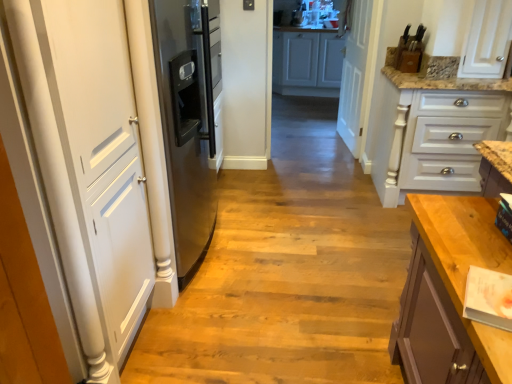
How much space does white painted wood drawers at right, the 2th cabinetry positioned from the top, occupy horizontally?

white painted wood drawers at right, the 2th cabinetry positioned from the top, is 28.20 inches in width.

What do you see at coordinates (288, 271) in the screenshot? I see `wooden floor at center` at bounding box center [288, 271].

Identify the location of white painted wood drawers at right, the 2th cabinetry viewed from the back. The height and width of the screenshot is (384, 512). (436, 133).

From the image's perspective, is white wood door at center, which is the 2th door in left-to-right order, located beneath wooden floor at center?

No, from the image's perspective, white wood door at center, which is the 2th door in left-to-right order, is not below wooden floor at center.

Could you tell me if white wood door at center, which is the 2th door in left-to-right order, is turned towards wooden floor at center?

No, white wood door at center, which is the 2th door in left-to-right order, is not oriented towards wooden floor at center.

Find the location of a particular element. the 1st door above the wooden floor at center (from a real-world perspective) is located at coordinates coord(354,74).

In terms of width, does white wood door at center, the first door viewed from the back, look wider or thinner when compared to wooden floor at center?

Considering their sizes, white wood door at center, the first door viewed from the back, looks slimmer than wooden floor at center.

Would you say white matte door at left, the 1th door viewed from the left, is to the left or to the right of white matte cabinet at center, the second cabinetry ordered from the bottom, in the picture?

white matte door at left, the 1th door viewed from the left, is to the left of white matte cabinet at center, the second cabinetry ordered from the bottom.

Is white matte door at left, the 1th door viewed from the left, facing away from white matte cabinet at center, marked as the 2th cabinetry in a front-to-back arrangement?

That's not correct — white matte door at left, the 1th door viewed from the left, is not looking away from white matte cabinet at center, marked as the 2th cabinetry in a front-to-back arrangement.

Can you see white matte door at left, the first door viewed from the front, touching white matte cabinet at center, the first cabinetry from the back?

No, white matte door at left, the first door viewed from the front, is not in contact with white matte cabinet at center, the first cabinetry from the back.

Can you confirm if white matte door at left, the 1th door viewed from the left, is smaller than white wood door at center, which is the first door from right to left?

No, white matte door at left, the 1th door viewed from the left, is not smaller than white wood door at center, which is the first door from right to left.

From a real-world perspective, between white matte door at left, the first door viewed from the front, and white wood door at center, positioned as the 2th door in front-to-back order, who is vertically higher?

From a 3D spatial view, white matte door at left, the first door viewed from the front, is above.

Considering the sizes of white matte door at left, arranged as the 2th door when viewed from the right, and white wood door at center, which is the first door from right to left, in the image, is white matte door at left, arranged as the 2th door when viewed from the right, wider or thinner than white wood door at center, which is the first door from right to left,?

In the image, white matte door at left, arranged as the 2th door when viewed from the right, appears to be wider than white wood door at center, which is the first door from right to left.

From the image's perspective, is white matte door at left, the first door viewed from the front, located beneath white wood door at center, the first door viewed from the back?

Yes.

In terms of width, does white wood door at center, positioned as the 2th door in front-to-back order, look wider or thinner when compared to white matte cabinet at center, which appears as the first cabinetry when viewed from the top?

white wood door at center, positioned as the 2th door in front-to-back order, is thinner than white matte cabinet at center, which appears as the first cabinetry when viewed from the top.

Which object is positioned more to the left, white wood door at center, which is the first door from right to left, or white matte cabinet at center, the second cabinetry ordered from the bottom?

From the viewer's perspective, white matte cabinet at center, the second cabinetry ordered from the bottom, appears more on the left side.

Are white wood door at center, which is the first door from right to left, and white matte cabinet at center, marked as the 2th cabinetry in a front-to-back arrangement, making contact?

There is a gap between white wood door at center, which is the first door from right to left, and white matte cabinet at center, marked as the 2th cabinetry in a front-to-back arrangement.

Where is `the 1st door in front when counting from the white matte cabinet at center, the first cabinetry from the back`? The width and height of the screenshot is (512, 384). the 1st door in front when counting from the white matte cabinet at center, the first cabinetry from the back is located at coordinates (354, 74).

Is white painted wood drawers at right, placed as the 1th cabinetry when sorted from bottom to top, positioned behind white wood door at center, positioned as the 2th door in front-to-back order?

No, the depth of white painted wood drawers at right, placed as the 1th cabinetry when sorted from bottom to top, is less than that of white wood door at center, positioned as the 2th door in front-to-back order.

Identify the location of door behind the white painted wood drawers at right, the 2th cabinetry viewed from the back. The height and width of the screenshot is (384, 512). (354, 74).

From a real-world perspective, relative to white wood door at center, the first door viewed from the back, is white painted wood drawers at right, the 2th cabinetry positioned from the top, vertically above or below?

white painted wood drawers at right, the 2th cabinetry positioned from the top, is situated lower than white wood door at center, the first door viewed from the back, in the real world.

Do you think white matte door at left, arranged as the 2th door when viewed from the right, is within white painted wood drawers at right, the 2th cabinetry viewed from the back, or outside of it?

white matte door at left, arranged as the 2th door when viewed from the right, is outside white painted wood drawers at right, the 2th cabinetry viewed from the back.

Considering the sizes of white matte door at left, arranged as the 2th door when viewed from the right, and white painted wood drawers at right, which is the first cabinetry in front-to-back order, in the image, is white matte door at left, arranged as the 2th door when viewed from the right, taller or shorter than white painted wood drawers at right, which is the first cabinetry in front-to-back order,?

white matte door at left, arranged as the 2th door when viewed from the right, is taller than white painted wood drawers at right, which is the first cabinetry in front-to-back order.

Which is nearer, (x=53, y=16) or (x=426, y=155)?

Point (x=53, y=16).

From the image's perspective, starting from the white matte door at left, which ranks as the second door in back-to-front order, which cabinetry is the 1st one above? Please provide its 2D coordinates.

[(436, 133)]

From the image's perspective, which is below, white matte door at left, the 1th door viewed from the left, or wooden floor at center?

wooden floor at center.

Can you confirm if white matte door at left, the first door viewed from the front, is thinner than wooden floor at center?

Yes.

Is white matte door at left, arranged as the 2th door when viewed from the right, far away from wooden floor at center?

No, white matte door at left, arranged as the 2th door when viewed from the right, is not far away from wooden floor at center.

Is white matte door at left, arranged as the 2th door when viewed from the right, in front of or behind wooden floor at center in the image?

Visually, white matte door at left, arranged as the 2th door when viewed from the right, is located in front of wooden floor at center.

The image size is (512, 384). I want to click on path located underneath the white wood door at center, the first door viewed from the back (from a real-world perspective), so click(288, 271).

From the image's perspective, count 2nd doors downward from the white matte cabinet at center, the first cabinetry from the back, and point to it. Please provide its 2D coordinates.

[(97, 163)]

Looking at the image, which one is located closer to wooden floor at center, white painted wood drawers at right, the 2th cabinetry viewed from the back, or white matte door at left, arranged as the 2th door when viewed from the right?

white painted wood drawers at right, the 2th cabinetry viewed from the back, is closer to wooden floor at center.

When comparing their distances from wooden floor at center, does white wood door at center, the first door viewed from the back, or white matte cabinet at center, marked as the 2th cabinetry in a front-to-back arrangement, seem further?

The object further to wooden floor at center is white matte cabinet at center, marked as the 2th cabinetry in a front-to-back arrangement.

Looking at the image, which one is located closer to white painted wood drawers at right, placed as the 1th cabinetry when sorted from bottom to top, white matte door at left, the 1th door viewed from the left, or white matte cabinet at center, the first cabinetry from the back?

Based on the image, white matte door at left, the 1th door viewed from the left, appears to be nearer to white painted wood drawers at right, placed as the 1th cabinetry when sorted from bottom to top.

Which object lies nearer to the anchor point white matte cabinet at center, the first cabinetry from the back, white matte door at left, the 1th door viewed from the left, or white painted wood drawers at right, the 2th cabinetry viewed from the back?

white painted wood drawers at right, the 2th cabinetry viewed from the back, is closer to white matte cabinet at center, the first cabinetry from the back.

Based on their spatial positions, is wooden floor at center or white wood door at center, the first door viewed from the back, closer to white matte cabinet at center, which appears as the first cabinetry when viewed from the top?

Among the two, white wood door at center, the first door viewed from the back, is located nearer to white matte cabinet at center, which appears as the first cabinetry when viewed from the top.

Considering their positions, is white matte cabinet at center, the first cabinetry from the back, positioned closer to white painted wood drawers at right, which is the first cabinetry in front-to-back order, than white matte door at left, the first door viewed from the front?

Based on the image, white matte door at left, the first door viewed from the front, appears to be nearer to white painted wood drawers at right, which is the first cabinetry in front-to-back order.

Estimate the real-world distances between objects in this image. Which object is closer to white matte door at left, the 1th door viewed from the left, white painted wood drawers at right, placed as the 1th cabinetry when sorted from bottom to top, or wooden floor at center?

wooden floor at center.

Which object lies nearer to the anchor point white wood door at center, which is the first door from right to left, white matte cabinet at center, which appears as the first cabinetry when viewed from the top, or white painted wood drawers at right, placed as the 1th cabinetry when sorted from bottom to top?

Based on the image, white painted wood drawers at right, placed as the 1th cabinetry when sorted from bottom to top, appears to be nearer to white wood door at center, which is the first door from right to left.

This screenshot has width=512, height=384. I want to click on path between white matte door at left, the 1th door viewed from the left, and white wood door at center, positioned as the 2th door in front-to-back order, from front to back, so click(288, 271).

Locate an element on the screen. The height and width of the screenshot is (384, 512). cabinetry positioned between wooden floor at center and white matte cabinet at center, which appears as the first cabinetry when viewed from the top, from near to far is located at coordinates (436, 133).

At what (x,y) coordinates should I click in order to perform the action: click on door between white matte door at left, the 1th door viewed from the left, and white matte cabinet at center, the first cabinetry from the back, along the z-axis. Please return your answer as a coordinate pair (x, y). Looking at the image, I should click on (354, 74).

The width and height of the screenshot is (512, 384). I want to click on path between white matte door at left, arranged as the 2th door when viewed from the right, and white painted wood drawers at right, the 2th cabinetry positioned from the top, so click(x=288, y=271).